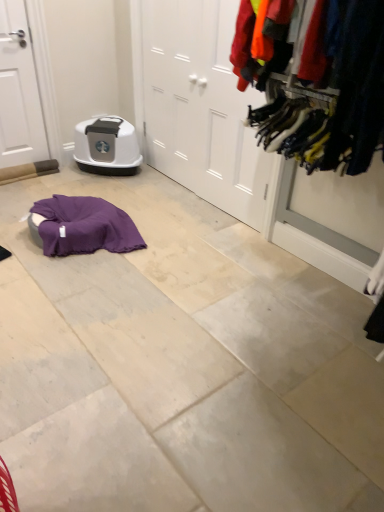
Locate an element on the screen. white matte door at center, positioned as the second door in left-to-right order is located at coordinates (201, 106).

At what (x,y) coordinates should I click in order to perform the action: click on textured fabric clothes at right. Please return your answer as a coordinate pair (x, y). Image resolution: width=384 pixels, height=512 pixels. Looking at the image, I should click on (318, 82).

Where is `white matte door at left, acting as the 1th door starting from the left`? The image size is (384, 512). white matte door at left, acting as the 1th door starting from the left is located at coordinates (19, 91).

How far apart are white matte door at left, acting as the 1th door starting from the left, and textured fabric clothes at right?

white matte door at left, acting as the 1th door starting from the left, and textured fabric clothes at right are 7.01 feet apart.

Is white matte door at left, acting as the 1th door starting from the left, placed right next to textured fabric clothes at right?

white matte door at left, acting as the 1th door starting from the left, and textured fabric clothes at right are not in contact.

Is white matte door at left, acting as the 1th door starting from the left, closer to camera compared to textured fabric clothes at right?

No, it is behind textured fabric clothes at right.

From a real-world perspective, which is physically below, white matte door at left, acting as the 1th door starting from the left, or textured fabric clothes at right?

white matte door at left, acting as the 1th door starting from the left, from a real-world perspective.

From a real-world perspective, is white matte door at center, positioned as the second door in left-to-right order, physically below textured fabric clothes at right?

Indeed, from a real-world perspective, white matte door at center, positioned as the second door in left-to-right order, is positioned beneath textured fabric clothes at right.

Consider the image. Is white matte door at center, acting as the first door starting from the right, to the left of textured fabric clothes at right from the viewer's perspective?

Correct, you'll find white matte door at center, acting as the first door starting from the right, to the left of textured fabric clothes at right.

Is white matte door at center, acting as the first door starting from the right, not within textured fabric clothes at right?

Yes.

Consider the image. Which of these two, white matte door at center, positioned as the second door in left-to-right order, or textured fabric clothes at right, is thinner?

With smaller width is white matte door at center, positioned as the second door in left-to-right order.

Is white matte door at center, positioned as the second door in left-to-right order, next to matte gray plastic litter box at center?

No, white matte door at center, positioned as the second door in left-to-right order, is not making contact with matte gray plastic litter box at center.

Is white matte door at center, acting as the first door starting from the right, outside of matte gray plastic litter box at center?

Yes, white matte door at center, acting as the first door starting from the right, is outside of matte gray plastic litter box at center.

Which of these two, white matte door at center, positioned as the second door in left-to-right order, or matte gray plastic litter box at center, stands taller?

white matte door at center, positioned as the second door in left-to-right order.

Find the location of a particular element. appliance below the white matte door at center, acting as the first door starting from the right (from the image's perspective) is located at coordinates (107, 147).

You are a GUI agent. You are given a task and a screenshot of the screen. Output one action in this format:
    pyautogui.click(x=<x>, y=<y>)
    Task: Click on the door that is on the right side of white matte door at left, positioned as the second door in right-to-left order
    
    Given the screenshot: What is the action you would take?
    pyautogui.click(x=201, y=106)

Is white matte door at left, acting as the 1th door starting from the left, completely or partially inside white matte door at center, acting as the first door starting from the right?

Actually, white matte door at left, acting as the 1th door starting from the left, is outside white matte door at center, acting as the first door starting from the right.

From the image's perspective, does white matte door at center, acting as the first door starting from the right, appear lower than white matte door at left, acting as the 1th door starting from the left?

Yes, from the image's perspective, white matte door at center, acting as the first door starting from the right, is below white matte door at left, acting as the 1th door starting from the left.

Measure the distance from white matte door at center, acting as the first door starting from the right, to white matte door at left, acting as the 1th door starting from the left.

They are 3.75 feet apart.

Between textured fabric clothes at right and white matte door at center, acting as the first door starting from the right, which one has smaller size?

white matte door at center, acting as the first door starting from the right, is smaller.

Is point (343, 99) positioned before point (155, 4)?

Yes.

The height and width of the screenshot is (512, 384). Identify the location of closet that appears below the white matte door at center, positioned as the second door in left-to-right order (from the image's perspective). (318, 82).

In terms of width, does textured fabric clothes at right look wider or thinner when compared to white matte door at center, acting as the first door starting from the right?

In the image, textured fabric clothes at right appears to be wider than white matte door at center, acting as the first door starting from the right.

From the image's perspective, between textured fabric clothes at right and matte gray plastic litter box at center, which one is located above?

matte gray plastic litter box at center appears higher in the image.

Considering the relative sizes of textured fabric clothes at right and matte gray plastic litter box at center in the image provided, is textured fabric clothes at right smaller than matte gray plastic litter box at center?

Incorrect, textured fabric clothes at right is not smaller in size than matte gray plastic litter box at center.

Looking at this image, are textured fabric clothes at right and matte gray plastic litter box at center far apart?

textured fabric clothes at right is positioned a significant distance from matte gray plastic litter box at center.

How many degrees apart are the facing directions of textured fabric clothes at right and matte gray plastic litter box at center?

51.1 degrees.

Is white matte door at left, positioned as the second door in right-to-left order, turned away from matte gray plastic litter box at center?

No, matte gray plastic litter box at center is not at the back of white matte door at left, positioned as the second door in right-to-left order.

From a real-world perspective, does white matte door at left, positioned as the second door in right-to-left order, stand above matte gray plastic litter box at center?

Indeed, from a real-world perspective, white matte door at left, positioned as the second door in right-to-left order, stands above matte gray plastic litter box at center.

Is white matte door at left, acting as the 1th door starting from the left, completely or partially outside of matte gray plastic litter box at center?

Absolutely, white matte door at left, acting as the 1th door starting from the left, is external to matte gray plastic litter box at center.

Find the location of a particular element. The width and height of the screenshot is (384, 512). door on the left of matte gray plastic litter box at center is located at coordinates (19, 91).

Find the location of a particular element. door that is the 2nd one below the textured fabric clothes at right (from a real-world perspective) is located at coordinates (19, 91).

You are a GUI agent. You are given a task and a screenshot of the screen. Output one action in this format:
    pyautogui.click(x=<x>, y=<y>)
    Task: Click on the 1st door behind the textured fabric clothes at right, starting your count from the anchor
    The height and width of the screenshot is (512, 384).
    Given the screenshot: What is the action you would take?
    pyautogui.click(x=201, y=106)

Based on the photo, based on their spatial positions, is white matte door at left, acting as the 1th door starting from the left, or textured fabric clothes at right further from matte gray plastic litter box at center?

Based on the image, textured fabric clothes at right appears to be further to matte gray plastic litter box at center.

Looking at the image, which one is located closer to textured fabric clothes at right, matte gray plastic litter box at center or white matte door at left, positioned as the second door in right-to-left order?

matte gray plastic litter box at center is closer to textured fabric clothes at right.

From the image, which object appears to be farther from textured fabric clothes at right, matte gray plastic litter box at center or white matte door at center, positioned as the second door in left-to-right order?

matte gray plastic litter box at center is further to textured fabric clothes at right.

Which object lies nearer to the anchor point white matte door at center, positioned as the second door in left-to-right order, white matte door at left, positioned as the second door in right-to-left order, or matte gray plastic litter box at center?

matte gray plastic litter box at center lies closer to white matte door at center, positioned as the second door in left-to-right order, than the other object.

Which object lies further to the anchor point matte gray plastic litter box at center, textured fabric clothes at right or white matte door at left, positioned as the second door in right-to-left order?

Among the two, textured fabric clothes at right is located further to matte gray plastic litter box at center.

From the image, which object appears to be farther from white matte door at center, acting as the first door starting from the right, textured fabric clothes at right or matte gray plastic litter box at center?

textured fabric clothes at right lies further to white matte door at center, acting as the first door starting from the right, than the other object.

Which object lies nearer to the anchor point white matte door at left, acting as the 1th door starting from the left, matte gray plastic litter box at center or white matte door at center, positioned as the second door in left-to-right order?

Among the two, matte gray plastic litter box at center is located nearer to white matte door at left, acting as the 1th door starting from the left.

Looking at the image, which one is located closer to matte gray plastic litter box at center, white matte door at center, positioned as the second door in left-to-right order, or white matte door at left, acting as the 1th door starting from the left?

The object closer to matte gray plastic litter box at center is white matte door at left, acting as the 1th door starting from the left.

Find the location of a particular element. Image resolution: width=384 pixels, height=512 pixels. door located between white matte door at left, positioned as the second door in right-to-left order, and textured fabric clothes at right in the left-right direction is located at coordinates (201, 106).

I want to click on appliance between white matte door at left, acting as the 1th door starting from the left, and white matte door at center, positioned as the second door in left-to-right order, so (x=107, y=147).